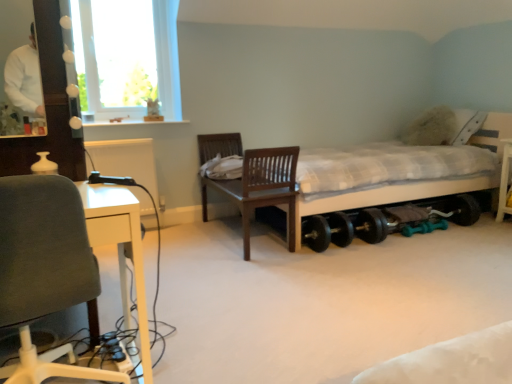
Locate an element on the screen. free space to the back side of gray fabric chair at left, which appears as the 1th chair when viewed from the left is located at coordinates (120, 324).